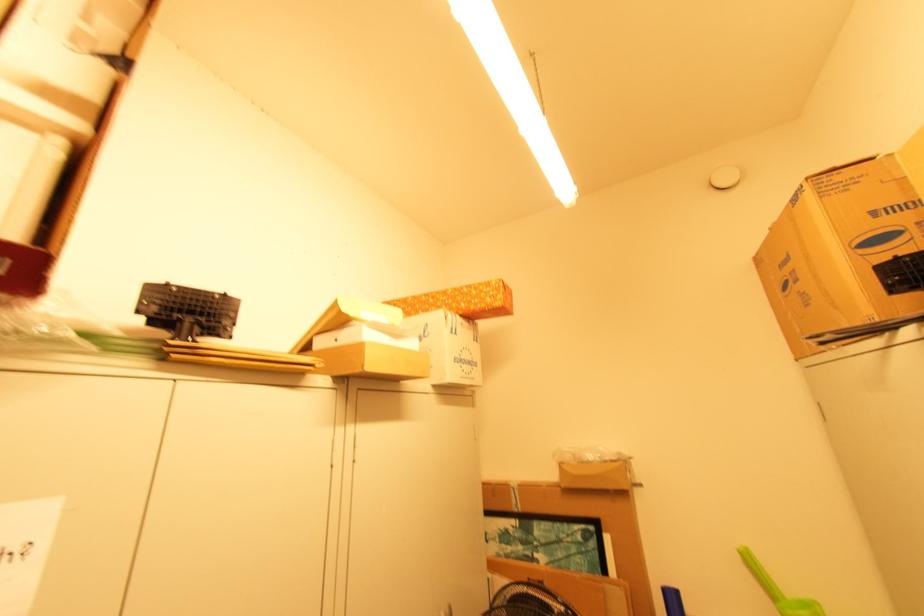
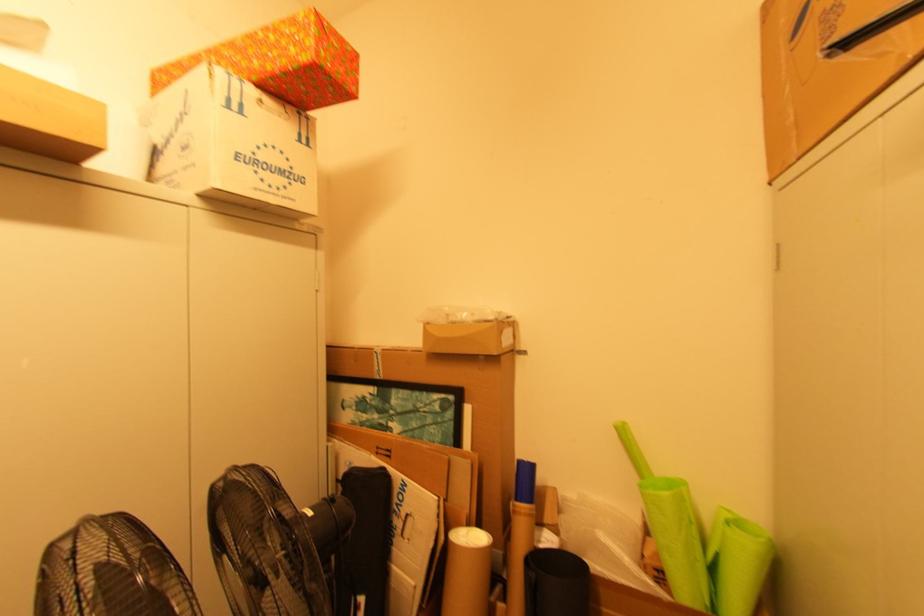
The point at (463, 355) is marked in the first image. Where is the corresponding point in the second image?

(257, 154)